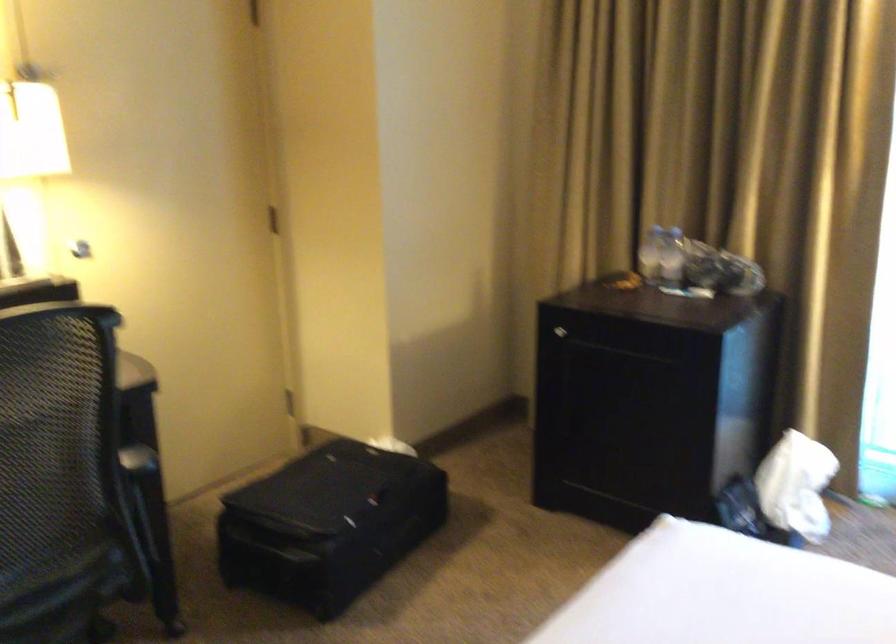
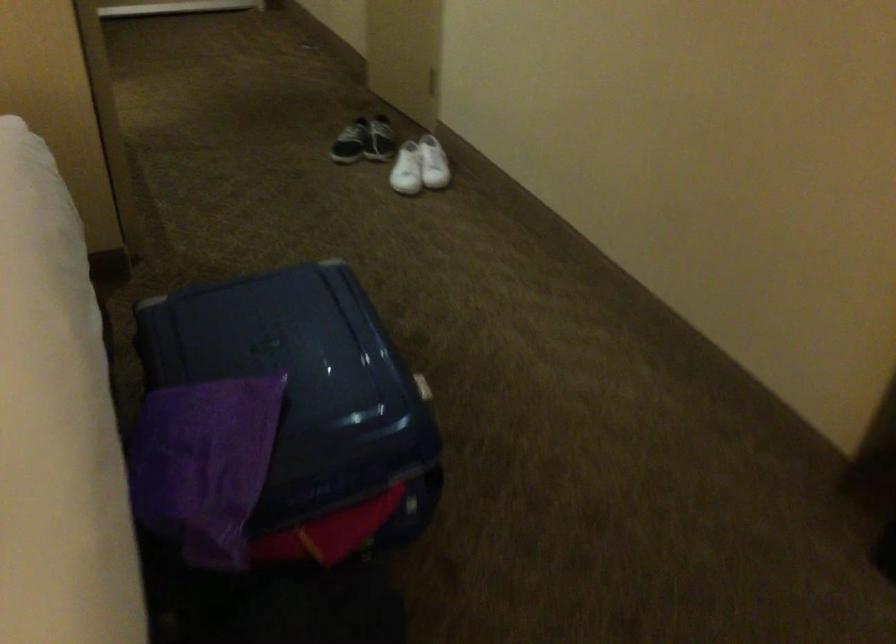
The first image is from the beginning of the video and the second image is from the end. How did the camera likely rotate when shooting the video?

The rotation direction of the camera is left-down.